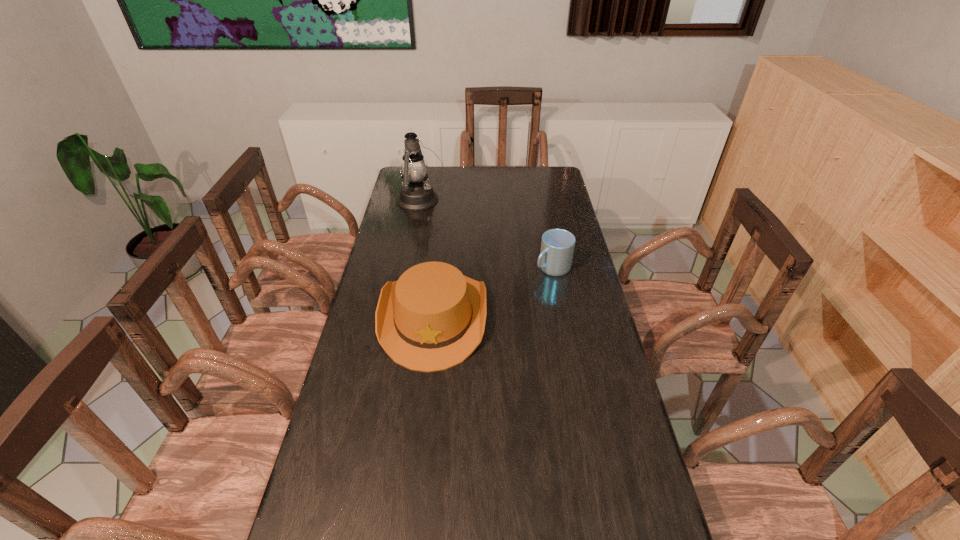
At what (x,y) coordinates should I click in order to perform the action: click on object at the right edge. Please return your answer as a coordinate pair (x, y). Image resolution: width=960 pixels, height=540 pixels. Looking at the image, I should click on (557, 246).

Image resolution: width=960 pixels, height=540 pixels. I want to click on object that is positioned at the far left corner, so click(415, 194).

The height and width of the screenshot is (540, 960). In order to click on vacant area at the far edge in this screenshot , I will do `click(473, 171)`.

Where is `vacant space at the left edge of the desktop`? The image size is (960, 540). vacant space at the left edge of the desktop is located at coordinates (402, 246).

Image resolution: width=960 pixels, height=540 pixels. In the image, there is a desktop. In order to click on vacant space at the right edge in this screenshot , I will do `click(574, 319)`.

Image resolution: width=960 pixels, height=540 pixels. Identify the location of vacant space at the far right corner. (550, 187).

You are a GUI agent. You are given a task and a screenshot of the screen. Output one action in this format:
    pyautogui.click(x=<x>, y=<y>)
    Task: Click on the vacant area that lies between the rightmost object and the cowboy hat
    The height and width of the screenshot is (540, 960).
    Given the screenshot: What is the action you would take?
    pyautogui.click(x=493, y=292)

The height and width of the screenshot is (540, 960). I want to click on free space between the cowboy hat and the rightmost object, so click(493, 292).

In order to click on object identified as the second closest to the cowboy hat in this screenshot , I will do `click(415, 194)`.

Locate an element on the screen. The image size is (960, 540). object identified as the second closest to the mug is located at coordinates (415, 194).